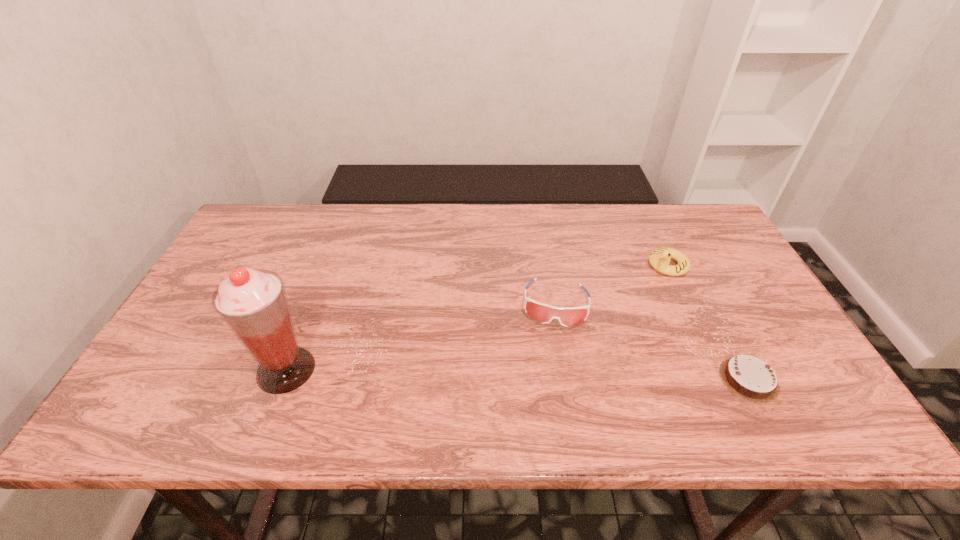
Image resolution: width=960 pixels, height=540 pixels. I want to click on the tallest object, so click(253, 303).

This screenshot has width=960, height=540. Identify the location of the leftmost object. (253, 303).

At what (x,y) coordinates should I click in order to perform the action: click on the shortest object. Please return your answer as a coordinate pair (x, y). Looking at the image, I should click on (748, 377).

Where is `the third nearest object`? The image size is (960, 540). the third nearest object is located at coordinates (568, 316).

At what (x,y) coordinates should I click in order to perform the action: click on goggles. Please return your answer as a coordinate pair (x, y). The width and height of the screenshot is (960, 540). Looking at the image, I should click on (568, 316).

This screenshot has height=540, width=960. Find the location of `duckling`. duckling is located at coordinates (659, 258).

Locate an element on the screen. Image resolution: width=960 pixels, height=540 pixels. free location located on the right of the leftmost object is located at coordinates (447, 370).

Where is `vacant point located 0.340m on the back of the shortest object`? vacant point located 0.340m on the back of the shortest object is located at coordinates (687, 263).

You are a GUI agent. You are given a task and a screenshot of the screen. Output one action in this format:
    pyautogui.click(x=<x>, y=<y>)
    Task: Click on the free space located 0.150m on the front-facing side of the goggles
    
    Given the screenshot: What is the action you would take?
    (x=550, y=381)

Find the location of a particular element. free space located on the front-facing side of the goggles is located at coordinates (551, 366).